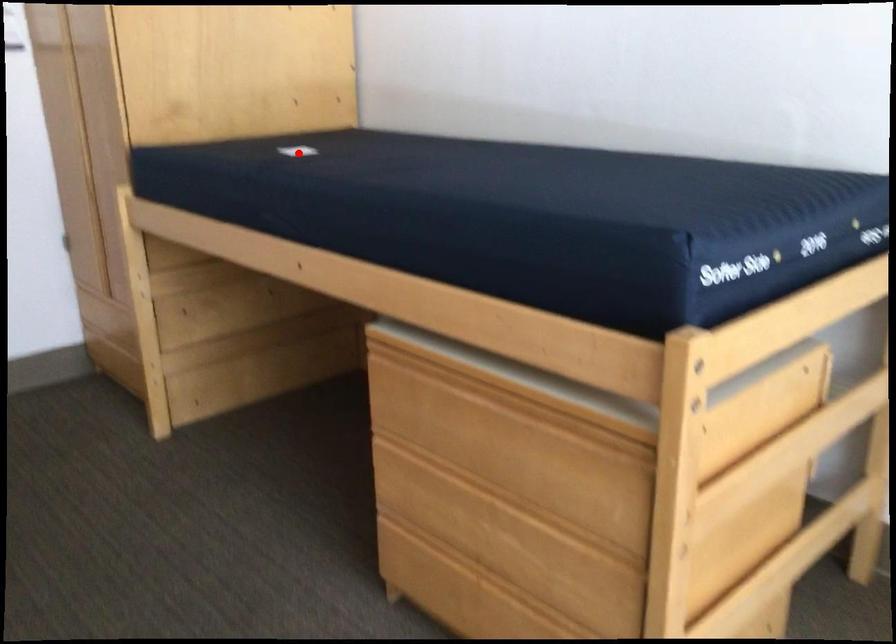
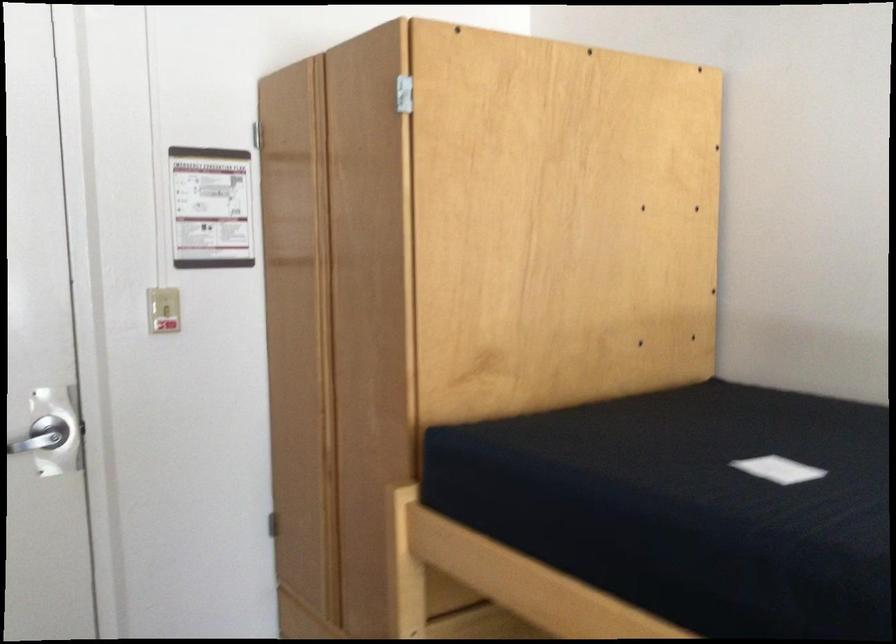
Question: I am providing you with two images of the same scene from different viewpoints. Given a red point in image1, look at the same physical point in image2. Is it:

Choices:
 (A) Closer to the viewpoint
 (B) Farther from the viewpoint

Answer: (A)